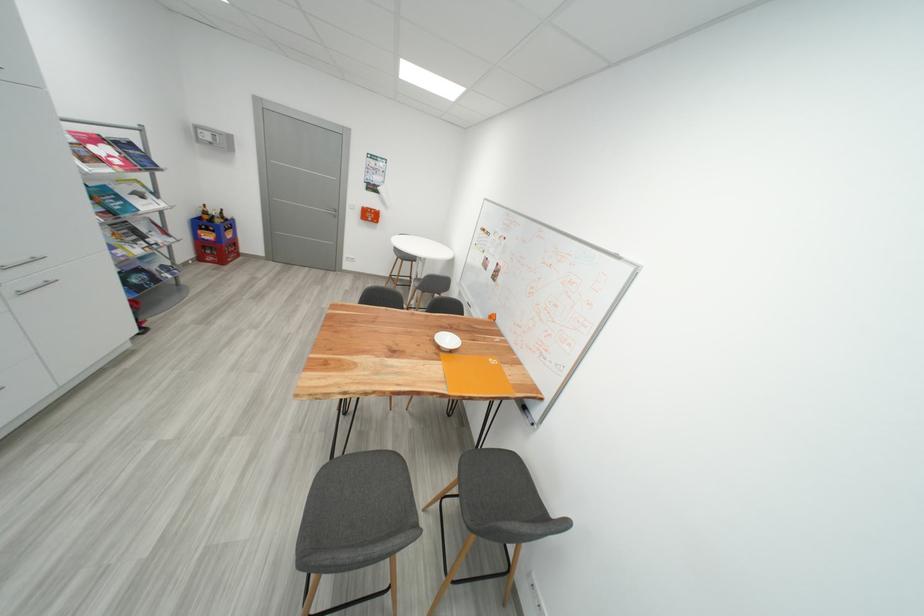
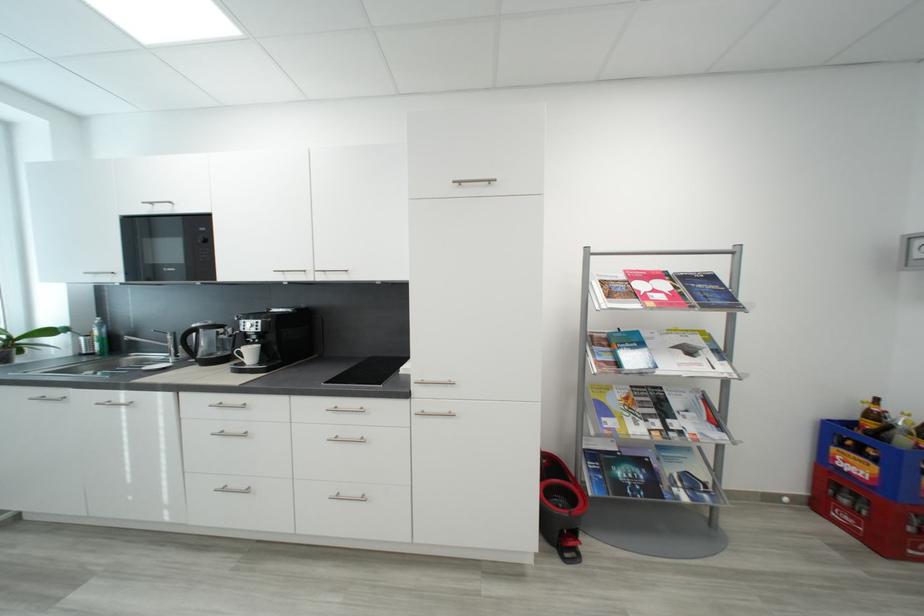
Locate, in the second image, the point that corresponds to (x=150, y=231) in the first image.

(684, 406)